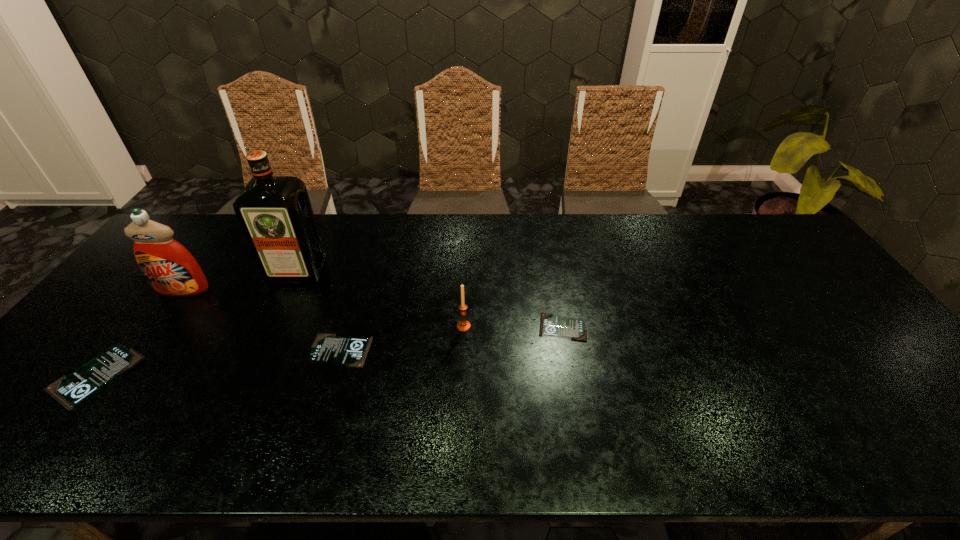
Locate an element on the screen. The image size is (960, 540). the leftmost identity card is located at coordinates (70, 390).

At what (x,y) coordinates should I click in order to perform the action: click on the fifth tallest object. Please return your answer as a coordinate pair (x, y). The image size is (960, 540). Looking at the image, I should click on (327, 348).

The height and width of the screenshot is (540, 960). In order to click on the second identity card from left to right in this screenshot , I will do `click(327, 348)`.

This screenshot has height=540, width=960. Find the location of `the shortest object`. the shortest object is located at coordinates tap(550, 325).

What are the coordinates of `the rightmost identity card` in the screenshot? It's located at tap(550, 325).

Where is `candle_holder`? Image resolution: width=960 pixels, height=540 pixels. candle_holder is located at coordinates (463, 325).

Locate an element on the screen. This screenshot has width=960, height=540. the third tallest object is located at coordinates (463, 325).

Find the location of a particular element. This screenshot has width=960, height=540. detergent is located at coordinates (169, 267).

Locate an element on the screen. This screenshot has height=540, width=960. liquor is located at coordinates (275, 213).

Find the location of `the fourth object from right to left`. the fourth object from right to left is located at coordinates (275, 213).